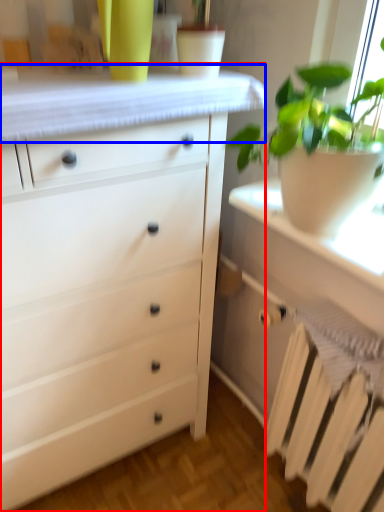
Question: Which of the following is the farthest to the observer, chest of drawers (highlighted by a red box) or counter top (highlighted by a blue box)?

Choices:
 (A) chest of drawers
 (B) counter top

Answer: (B)